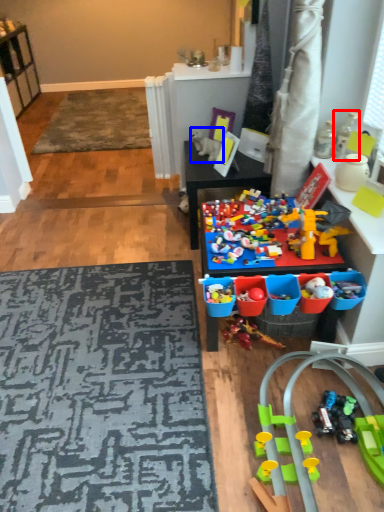
Question: Among these objects, which one is farthest to the camera, toy (highlighted by a red box) or toy (highlighted by a blue box)?

Choices:
 (A) toy
 (B) toy

Answer: (B)